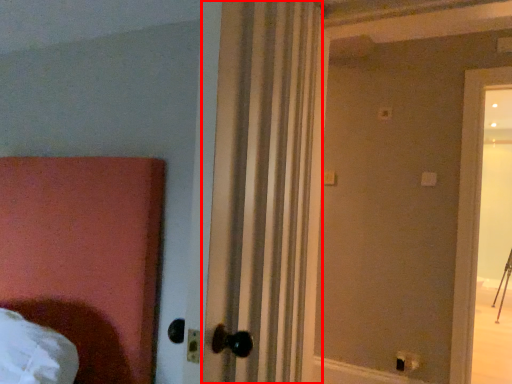
Question: From the image, what is the correct spatial relationship of curtain (annotated by the red box) in relation to electric outlet?

Choices:
 (A) right
 (B) left

Answer: (B)